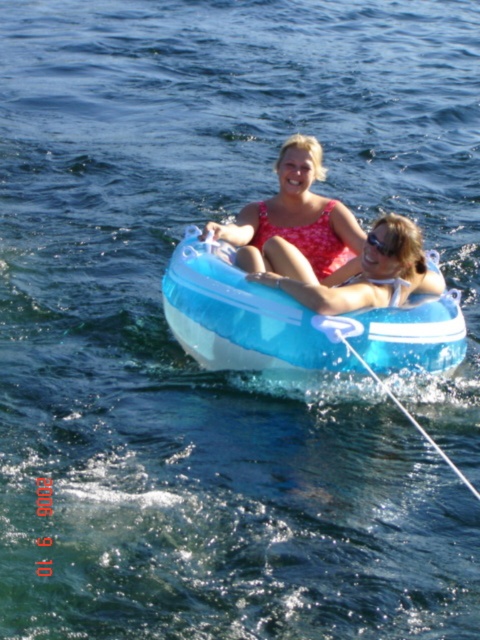
Is translucent blue tube at center closer to the viewer compared to floral swimsuit at center?

Yes, it is.

Locate an element on the screen. This screenshot has height=640, width=480. translucent blue tube at center is located at coordinates (297, 323).

Does floral swimsuit at center have a smaller size compared to matte blue tube at center?

Yes, floral swimsuit at center is smaller than matte blue tube at center.

Who is higher up, floral swimsuit at center or matte blue tube at center?

floral swimsuit at center

Find the location of a particular element. Image resolution: width=480 pixels, height=640 pixels. floral swimsuit at center is located at coordinates (295, 216).

The width and height of the screenshot is (480, 640). I want to click on floral swimsuit at center, so click(x=295, y=216).

Does translucent blue tube at center come behind matte blue tube at center?

No, it is not.

Who is positioned more to the left, translucent blue tube at center or matte blue tube at center?

translucent blue tube at center is more to the left.

Where is `translucent blue tube at center`? This screenshot has width=480, height=640. translucent blue tube at center is located at coordinates (297, 323).

Where is `translucent blue tube at center`? translucent blue tube at center is located at coordinates (297, 323).